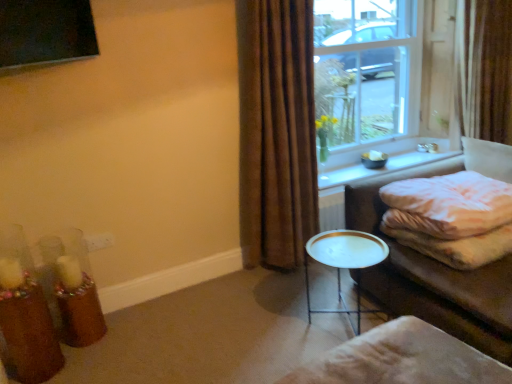
Question: Looking at their shapes, would you say translucent glass candle holder at lower left, the 2th candle holder viewed from the back, is wider or thinner than clear glass window at upper right?

Choices:
 (A) thin
 (B) wide

Answer: (B)

Question: From the image's perspective, is translucent glass candle holder at lower left, the 2th candle holder viewed from the back, above or below clear glass window at upper right?

Choices:
 (A) below
 (B) above

Answer: (A)

Question: Based on their relative distances, which object is nearer to the translucent glass candle holder at lower left, the 1th candle holder from the front?

Choices:
 (A) brown fabric curtain at right, which is counted as the second curtain, starting from the front
 (B) white textured blanket at right
 (C) beige fabric footrest at lower right
 (D) white glossy window sill at upper right
 (E) brown velvet curtain at center, marked as the second curtain in a back-to-front arrangement

Answer: (C)

Question: Which of these objects is positioned farthest from the clear glass window at upper right?

Choices:
 (A) white textured blanket at right
 (B) translucent glass candle holder at lower left, the 2th candle holder viewed from the back
 (C) white glossy side table at center
 (D) translucent glass candle holder at lower left, arranged as the second candle holder when viewed from the front
 (E) beige fabric footrest at lower right

Answer: (B)